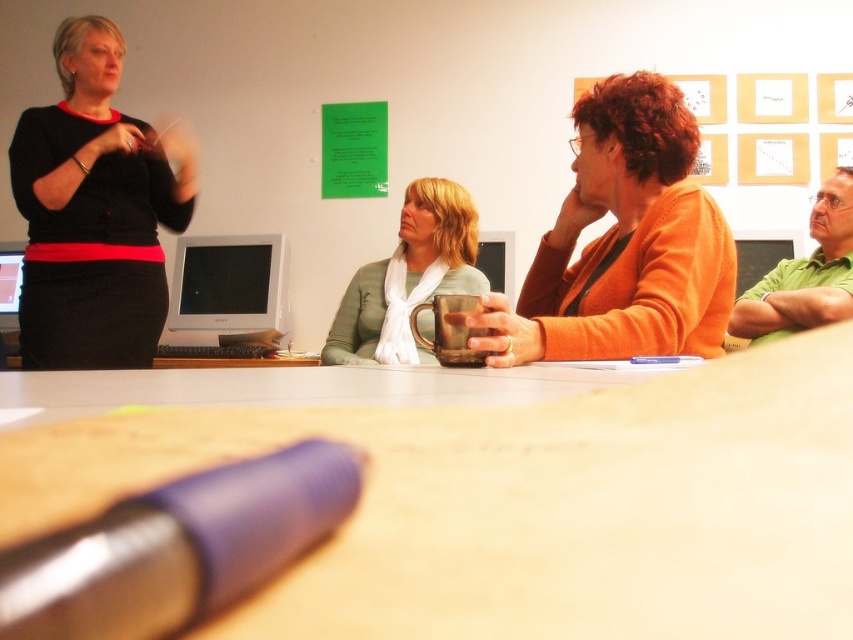
Can you confirm if orange matte sweater at center is positioned below matte gray monitor at center?

Actually, orange matte sweater at center is above matte gray monitor at center.

Does orange matte sweater at center appear over matte gray monitor at center?

Indeed, orange matte sweater at center is positioned over matte gray monitor at center.

Where is `orange matte sweater at center`? orange matte sweater at center is located at coordinates click(x=624, y=243).

Can you confirm if metallic blue pen at lower left is positioned to the left of matte black monitor at left?

No, metallic blue pen at lower left is not to the left of matte black monitor at left.

Looking at this image, is metallic blue pen at lower left to the right of matte black monitor at left from the viewer's perspective?

Yes, metallic blue pen at lower left is to the right of matte black monitor at left.

Which is in front, point (47, 547) or point (0, 282)?

Point (47, 547) is more forward.

Find the location of a particular element. metallic blue pen at lower left is located at coordinates (178, 547).

Who is shorter, smooth wooden table at center or orange matte sweater at center?

smooth wooden table at center is shorter.

Who is positioned more to the right, smooth wooden table at center or orange matte sweater at center?

orange matte sweater at center is more to the right.

Between point (459, 429) and point (618, 99), which one is positioned behind?

Point (618, 99)

Find the location of `smooth wooden table at center`. smooth wooden table at center is located at coordinates pos(527,504).